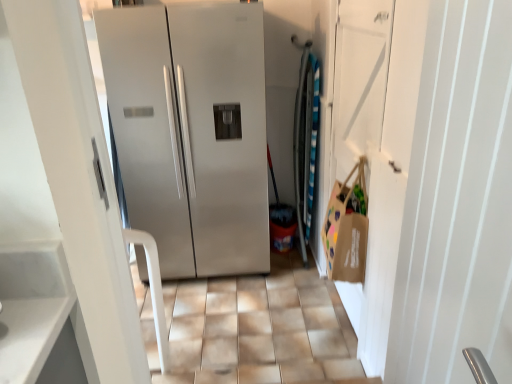
Question: Is satin silver refrigerator at center inside or outside of brown paper bag at right?

Choices:
 (A) inside
 (B) outside

Answer: (B)

Question: Considering the positions of satin silver refrigerator at center and brown paper bag at right in the image, is satin silver refrigerator at center wider or thinner than brown paper bag at right?

Choices:
 (A) wide
 (B) thin

Answer: (A)

Question: Estimate the real-world distances between objects in this image. Which object is farther from the satin silver refrigerator at center?

Choices:
 (A) brown paper bag at right
 (B) brown paper bag at right

Answer: (A)

Question: Estimate the real-world distances between objects in this image. Which object is farther from the satin silver refrigerator at center?

Choices:
 (A) brown paper bag at right
 (B) brown paper bag at right

Answer: (B)